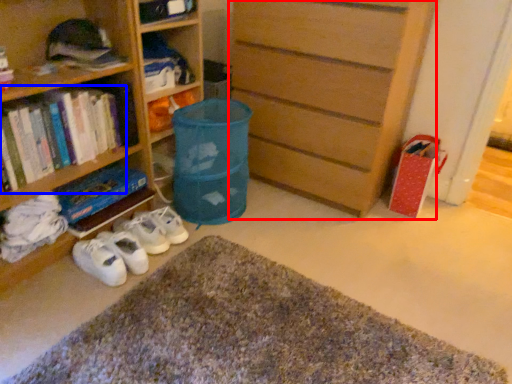
Question: Which object appears closest to the camera in this image, chest of drawers (highlighted by a red box) or book (highlighted by a blue box)?

Choices:
 (A) chest of drawers
 (B) book

Answer: (B)